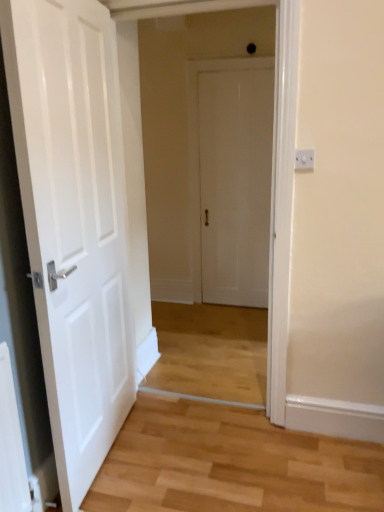
Question: Which direction should I rotate to face white matte door at center, which ranks as the 1th door in right-to-left order, — up or down?

Choices:
 (A) down
 (B) up

Answer: (B)

Question: Does white plastic switch at upper right touch white matte door at center, which is the 1th door in left-to-right order?

Choices:
 (A) no
 (B) yes

Answer: (A)

Question: Can you confirm if white plastic switch at upper right is bigger than white matte door at center, the first door when ordered from front to back?

Choices:
 (A) no
 (B) yes

Answer: (A)

Question: Are white plastic switch at upper right and white matte door at center, placed as the 2th door when sorted from right to left, far apart?

Choices:
 (A) yes
 (B) no

Answer: (A)

Question: Does white plastic switch at upper right appear on the left side of white matte door at center, placed as the 2th door when sorted from right to left?

Choices:
 (A) no
 (B) yes

Answer: (A)

Question: Does white plastic switch at upper right have a greater height compared to white matte door at center, placed as the second door when sorted from back to front?

Choices:
 (A) yes
 (B) no

Answer: (B)

Question: From a real-world perspective, is white plastic switch at upper right located beneath white matte door at center, placed as the 2th door when sorted from right to left?

Choices:
 (A) no
 (B) yes

Answer: (A)

Question: Could you tell me if white matte door at center, which is the 2th door in left-to-right order, is facing white plastic switch at upper right?

Choices:
 (A) yes
 (B) no

Answer: (A)

Question: Is white matte door at center, the second door in the front-to-back sequence, smaller than white plastic switch at upper right?

Choices:
 (A) no
 (B) yes

Answer: (A)

Question: Can you confirm if white matte door at center, the 1th door positioned from the back, is taller than white plastic switch at upper right?

Choices:
 (A) no
 (B) yes

Answer: (B)

Question: Considering the relative sizes of white matte door at center, the 1th door positioned from the back, and white plastic switch at upper right in the image provided, is white matte door at center, the 1th door positioned from the back, shorter than white plastic switch at upper right?

Choices:
 (A) no
 (B) yes

Answer: (A)

Question: Would you say white matte door at center, which ranks as the 1th door in right-to-left order, is outside white plastic switch at upper right?

Choices:
 (A) yes
 (B) no

Answer: (A)

Question: Is white matte door at center, the second door in the front-to-back sequence, beside white plastic switch at upper right?

Choices:
 (A) no
 (B) yes

Answer: (A)

Question: Can white matte door at center, which ranks as the 1th door in right-to-left order, be found inside white matte door at center, the first door when ordered from front to back?

Choices:
 (A) no
 (B) yes

Answer: (A)